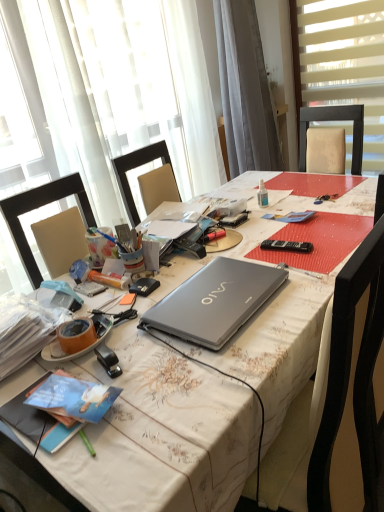
The image size is (384, 512). Identify the location of vacant point to the left of black plastic remote control at center. (246, 250).